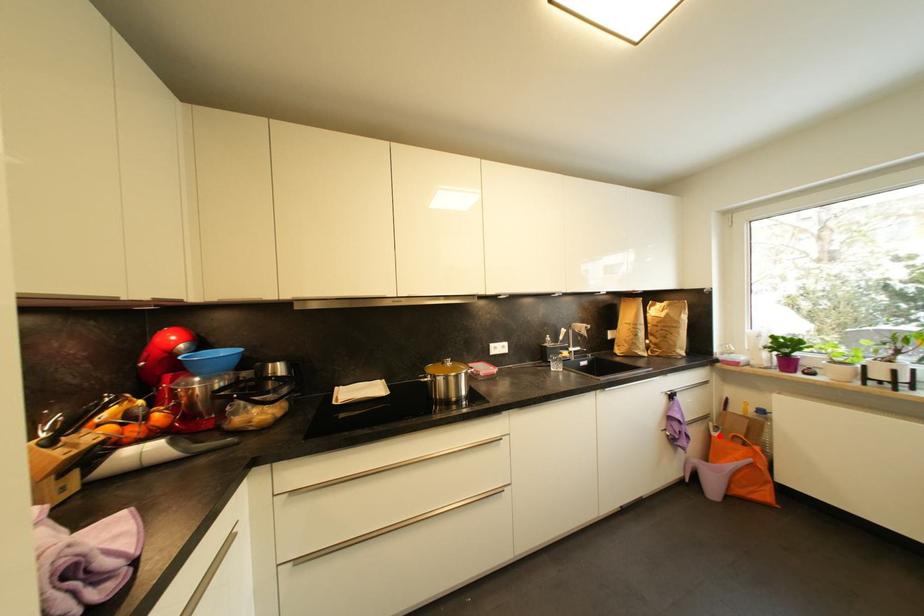
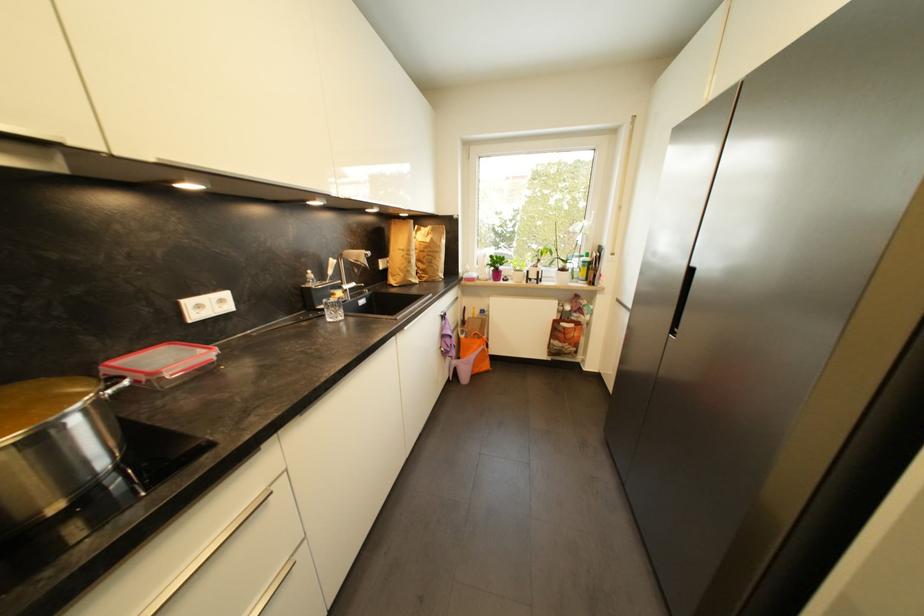
The point at the highlighted location is marked in the first image. Where is the corresponding point in the second image?

(468, 339)